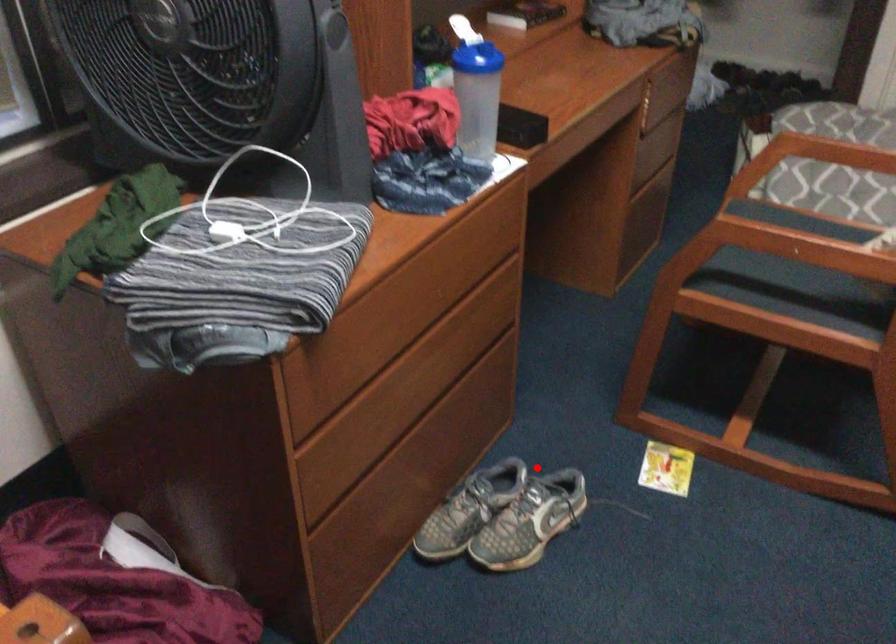
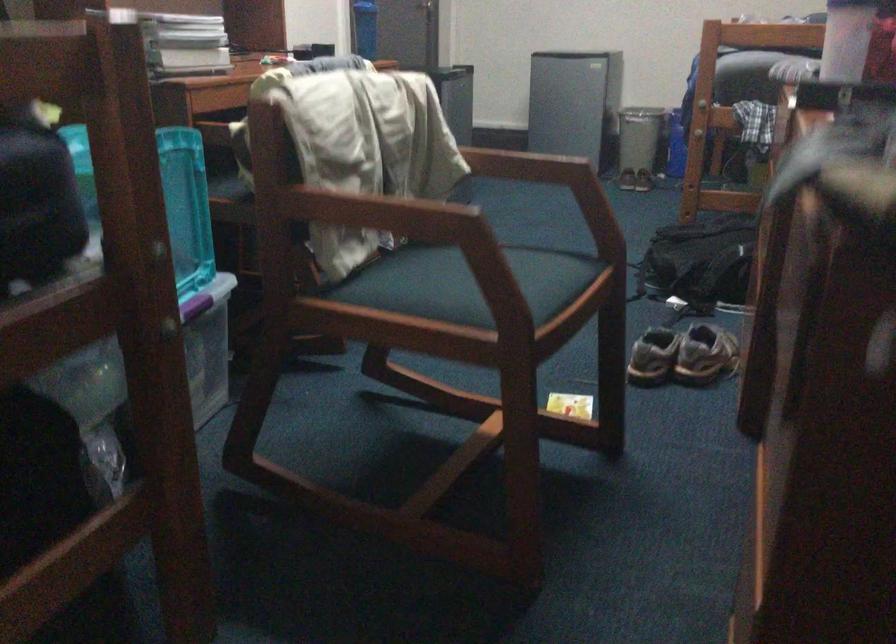
The point at the highlighted location is marked in the first image. Where is the corresponding point in the second image?

(682, 355)